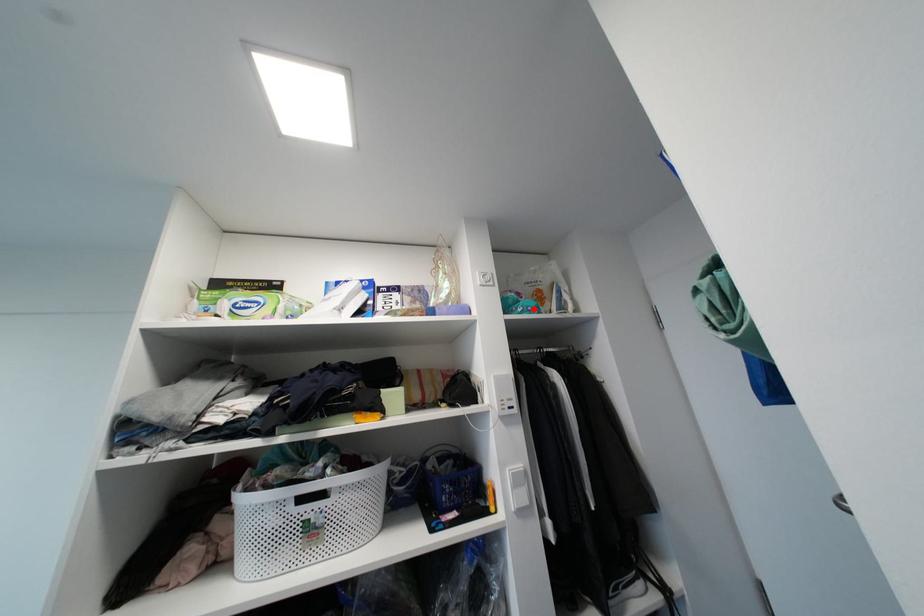
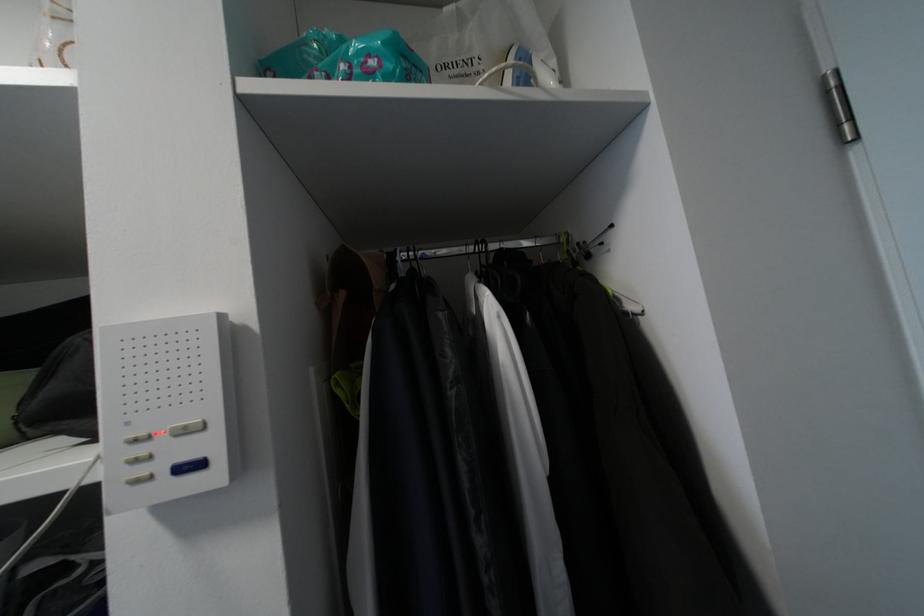
Locate, in the second image, the point that corresponds to the highlighted location in the first image.

(377, 63)